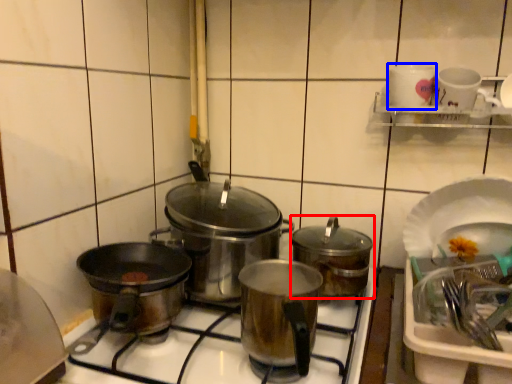
Question: Among these objects, which one is farthest to the camera, kitchen appliance (highlighted by a red box) or tableware (highlighted by a blue box)?

Choices:
 (A) kitchen appliance
 (B) tableware

Answer: (B)